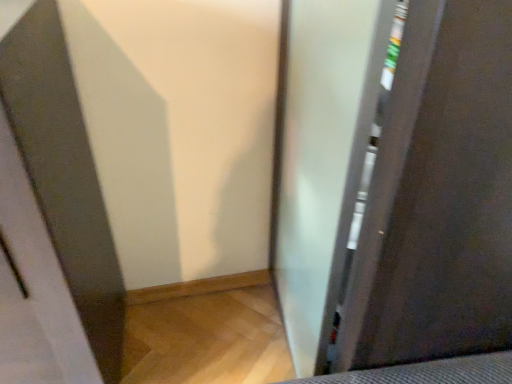
Question: Relative to frosted glass screen door at right, the 2th screen door when ordered from left to right, is clear glass screen door at left, acting as the first screen door starting from the left, in front or behind?

Choices:
 (A) behind
 (B) front

Answer: (B)

Question: Based on their sizes in the image, would you say clear glass screen door at left, which ranks as the second screen door in right-to-left order, is bigger or smaller than frosted glass screen door at right, arranged as the first screen door when viewed from the right?

Choices:
 (A) small
 (B) big

Answer: (B)

Question: Is clear glass screen door at left, acting as the first screen door starting from the left, inside the boundaries of frosted glass screen door at right, the 2th screen door when ordered from left to right, or outside?

Choices:
 (A) inside
 (B) outside

Answer: (B)

Question: Looking at the image, does frosted glass screen door at right, arranged as the first screen door when viewed from the right, seem bigger or smaller compared to clear glass screen door at left, acting as the first screen door starting from the left?

Choices:
 (A) big
 (B) small

Answer: (B)

Question: From a real-world perspective, relative to clear glass screen door at left, which ranks as the second screen door in right-to-left order, is frosted glass screen door at right, arranged as the first screen door when viewed from the right, vertically above or below?

Choices:
 (A) below
 (B) above

Answer: (B)

Question: Considering the positions of point (436, 311) and point (1, 72), is point (436, 311) closer or farther from the camera than point (1, 72)?

Choices:
 (A) closer
 (B) farther

Answer: (B)

Question: Considering the positions of frosted glass screen door at right, arranged as the first screen door when viewed from the right, and clear glass screen door at left, acting as the first screen door starting from the left, in the image, is frosted glass screen door at right, arranged as the first screen door when viewed from the right, taller or shorter than clear glass screen door at left, acting as the first screen door starting from the left,?

Choices:
 (A) tall
 (B) short

Answer: (A)